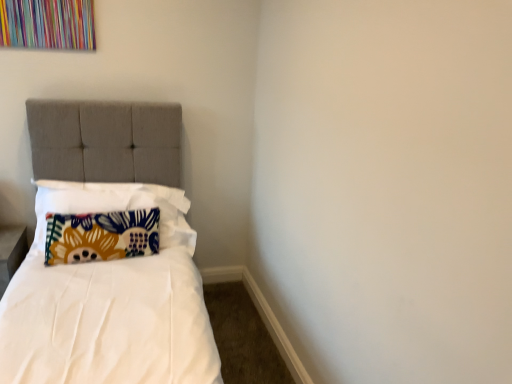
Question: Could you tell me if floral fabric pillow at left, arranged as the 2th pillow when viewed from the back, is turned towards floral fabric pillow at left, the 2th pillow from the front?

Choices:
 (A) yes
 (B) no

Answer: (A)

Question: Can you confirm if floral fabric pillow at left, arranged as the 2th pillow when viewed from the back, is positioned to the left of floral fabric pillow at left, arranged as the 1th pillow when viewed from the back?

Choices:
 (A) no
 (B) yes

Answer: (A)

Question: Can you confirm if floral fabric pillow at left, which is counted as the 1th pillow, starting from the front, is smaller than floral fabric pillow at left, arranged as the 1th pillow when viewed from the back?

Choices:
 (A) yes
 (B) no

Answer: (B)

Question: Is floral fabric pillow at left, which is counted as the 1th pillow, starting from the front, next to floral fabric pillow at left, arranged as the 1th pillow when viewed from the back, and touching it?

Choices:
 (A) no
 (B) yes

Answer: (A)

Question: Is floral fabric pillow at left, arranged as the 2th pillow when viewed from the back, not within floral fabric pillow at left, the 2th pillow from the front?

Choices:
 (A) no
 (B) yes

Answer: (B)

Question: Does floral fabric pillow at left, arranged as the 2th pillow when viewed from the back, have a larger size compared to floral fabric pillow at left, arranged as the 1th pillow when viewed from the back?

Choices:
 (A) no
 (B) yes

Answer: (B)

Question: Considering the relative sizes of floral fabric pillow at left, arranged as the 1th pillow when viewed from the back, and floral fabric pillow at left, which is counted as the 1th pillow, starting from the front, in the image provided, is floral fabric pillow at left, arranged as the 1th pillow when viewed from the back, smaller than floral fabric pillow at left, which is counted as the 1th pillow, starting from the front,?

Choices:
 (A) yes
 (B) no

Answer: (A)

Question: Does floral fabric pillow at left, arranged as the 1th pillow when viewed from the back, contain floral fabric pillow at left, arranged as the 2th pillow when viewed from the back?

Choices:
 (A) yes
 (B) no

Answer: (B)

Question: Does floral fabric pillow at left, arranged as the 1th pillow when viewed from the back, have a larger size compared to floral fabric pillow at left, which is counted as the 1th pillow, starting from the front?

Choices:
 (A) yes
 (B) no

Answer: (B)

Question: Is there a large distance between floral fabric pillow at left, the 2th pillow from the front, and floral fabric pillow at left, arranged as the 2th pillow when viewed from the back?

Choices:
 (A) no
 (B) yes

Answer: (A)

Question: Does floral fabric pillow at left, arranged as the 1th pillow when viewed from the back, lie behind floral fabric pillow at left, arranged as the 2th pillow when viewed from the back?

Choices:
 (A) no
 (B) yes

Answer: (B)

Question: Is floral fabric pillow at left, the 2th pillow from the front, next to floral fabric pillow at left, which is counted as the 1th pillow, starting from the front?

Choices:
 (A) yes
 (B) no

Answer: (B)

Question: From their relative heights in the image, would you say floral fabric pillow at left, arranged as the 1th pillow when viewed from the back, is taller or shorter than floral fabric pillow at left, which is counted as the 1th pillow, starting from the front?

Choices:
 (A) short
 (B) tall

Answer: (A)